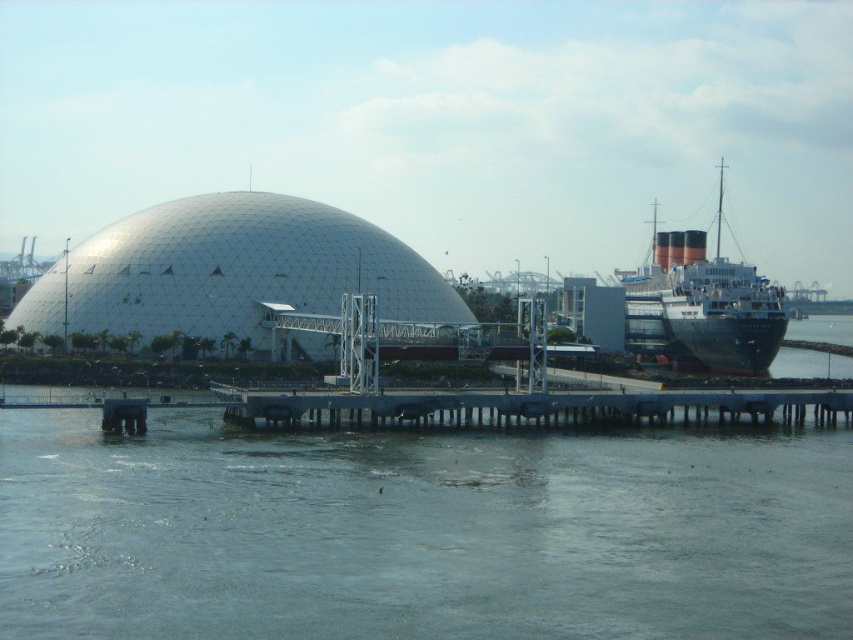
Which is in front, point (618, 524) or point (151, 289)?

Positioned in front is point (618, 524).

Who is positioned more to the left, clear water at lower center or white geodesic dome at center?

white geodesic dome at center

Describe the element at coordinates (421, 532) in the screenshot. I see `clear water at lower center` at that location.

The image size is (853, 640). What are the coordinates of `clear water at lower center` in the screenshot? It's located at (421, 532).

Does clear water at lower center have a larger size compared to blue metallic dock at center?

Indeed, clear water at lower center has a larger size compared to blue metallic dock at center.

Is clear water at lower center to the left of blue metallic dock at center from the viewer's perspective?

Indeed, clear water at lower center is positioned on the left side of blue metallic dock at center.

Find the location of a particular element. The image size is (853, 640). clear water at lower center is located at coordinates (421, 532).

Can you confirm if white geodesic dome at center is positioned below blue metallic dock at center?

No.

Is point (381, 243) more distant than point (651, 419)?

Yes, it is behind point (651, 419).

Is point (193, 275) in front of point (824, 396)?

That is False.

The image size is (853, 640). I want to click on white geodesic dome at center, so tap(231, 272).